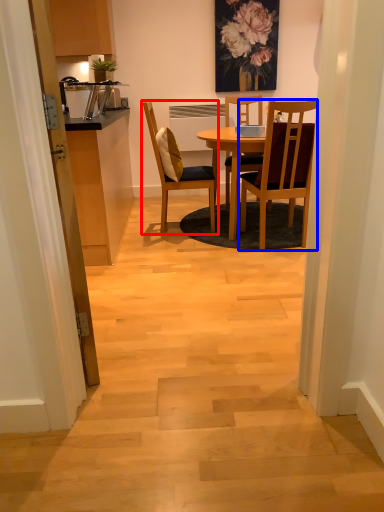
Question: Which object is closer to the camera taking this photo, chair (highlighted by a red box) or chair (highlighted by a blue box)?

Choices:
 (A) chair
 (B) chair

Answer: (B)